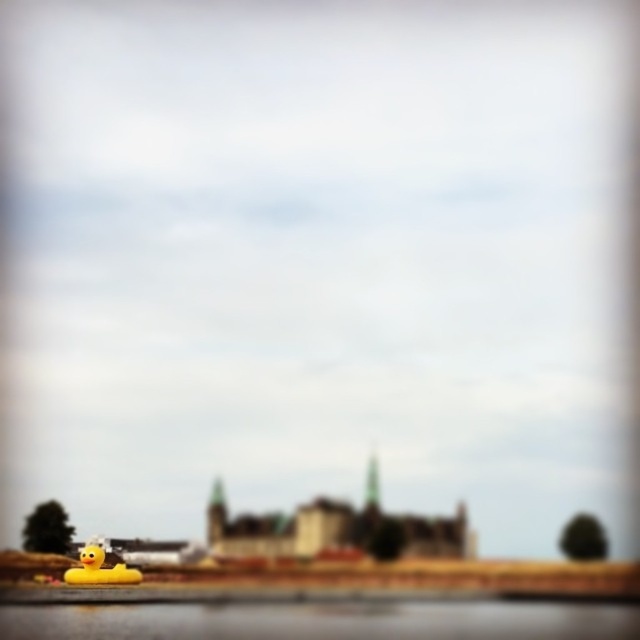
The height and width of the screenshot is (640, 640). I want to click on transparent plastic water at lower left, so click(323, 620).

Does transparent plastic water at lower left lie behind yellow rubber duck at lower left?

No, transparent plastic water at lower left is closer to the viewer.

Describe the element at coordinates (323, 620) in the screenshot. I see `transparent plastic water at lower left` at that location.

This screenshot has width=640, height=640. What are the coordinates of `transparent plastic water at lower left` in the screenshot? It's located at (323, 620).